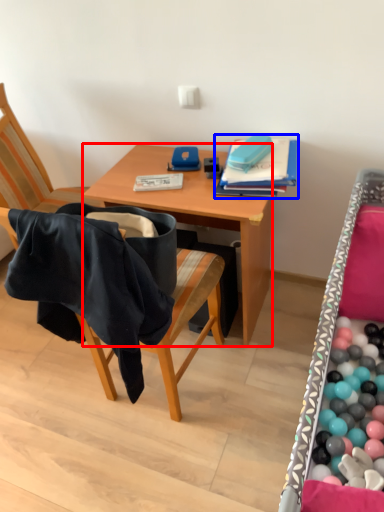
Question: Which object is closer to the camera taking this photo, desk (highlighted by a red box) or book (highlighted by a blue box)?

Choices:
 (A) desk
 (B) book

Answer: (A)